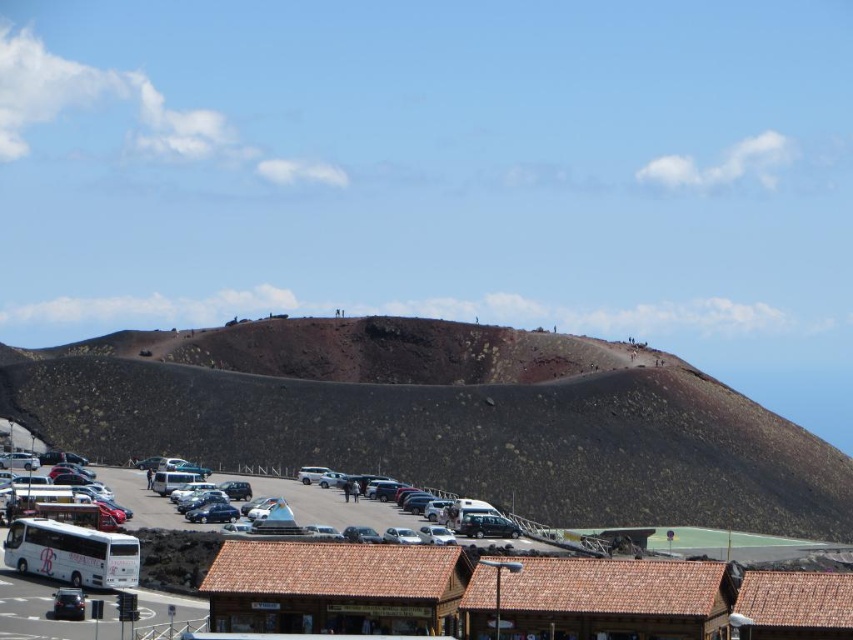
Between volcanic rock mountain at upper center and white matte bus at lower left, which one has less height?

Standing shorter between the two is white matte bus at lower left.

Does point (357, 456) come closer to viewer compared to point (74, 568)?

No.

Is point (300, 380) less distant than point (28, 554)?

No.

I want to click on volcanic rock mountain at upper center, so click(442, 419).

Who is higher up, volcanic rock mountain at upper center or white matte bus at center?

volcanic rock mountain at upper center is above.

Describe the element at coordinates (442, 419) in the screenshot. I see `volcanic rock mountain at upper center` at that location.

Find the location of a particular element. Image resolution: width=853 pixels, height=640 pixels. volcanic rock mountain at upper center is located at coordinates (442, 419).

Can you confirm if white matte bus at lower left is taller than white matte bus at center?

Correct, white matte bus at lower left is much taller as white matte bus at center.

Which is behind, point (125, 561) or point (169, 483)?

Positioned behind is point (169, 483).

Find the location of a particular element. The width and height of the screenshot is (853, 640). white matte bus at lower left is located at coordinates (73, 554).